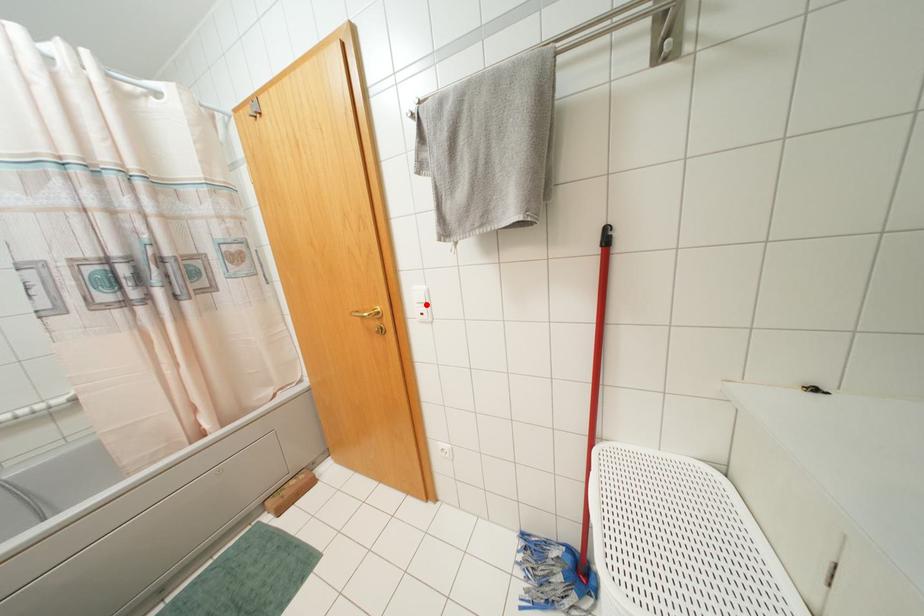
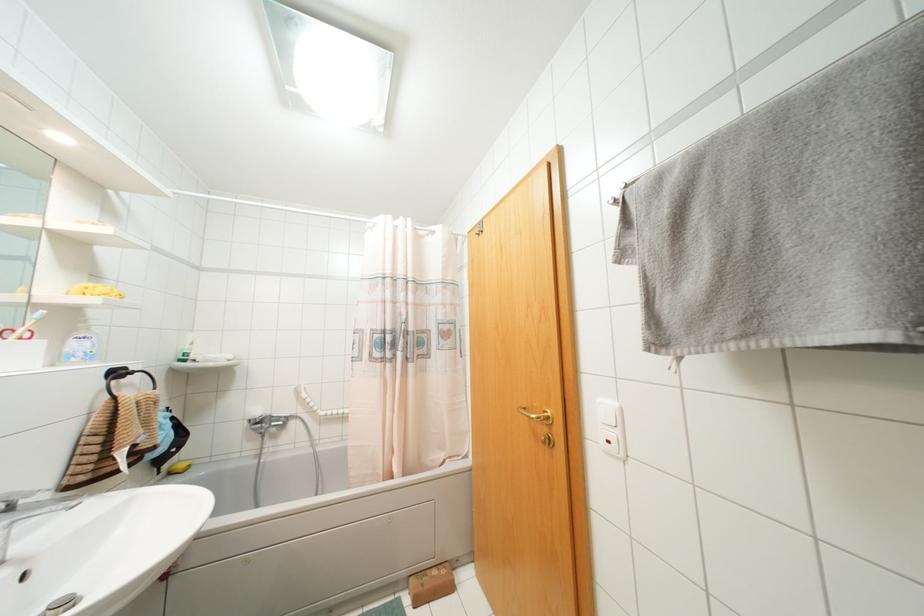
Locate, in the second image, the point that corresponds to the highlighted location in the first image.

(617, 431)